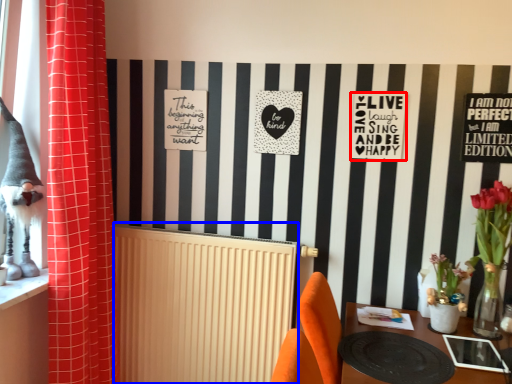
Question: Among these objects, which one is nearest to the camera, postcard (highlighted by a red box) or radiator (highlighted by a blue box)?

Choices:
 (A) postcard
 (B) radiator

Answer: (A)